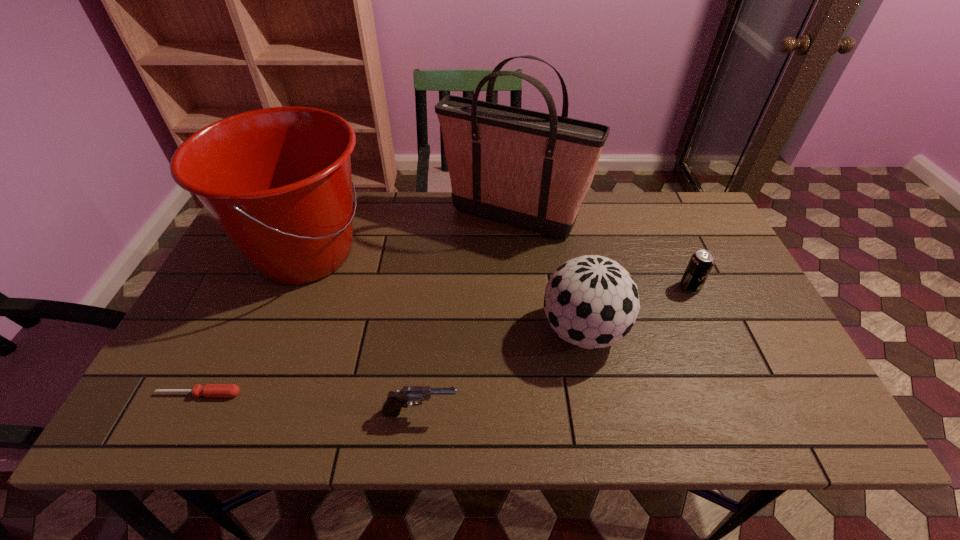
The width and height of the screenshot is (960, 540). I want to click on vacant area that lies between the shopping bag and the soda can, so click(x=601, y=253).

At what (x,y) coordinates should I click in order to perform the action: click on free spot between the shopping bag and the pistol. Please return your answer as a coordinate pair (x, y). Image resolution: width=960 pixels, height=540 pixels. Looking at the image, I should click on (467, 315).

Image resolution: width=960 pixels, height=540 pixels. I want to click on free space between the shopping bag and the fifth farthest object, so click(356, 306).

You are a GUI agent. You are given a task and a screenshot of the screen. Output one action in this format:
    pyautogui.click(x=<x>, y=<y>)
    Task: Click on the empty location between the pistol and the second tallest object
    
    Given the screenshot: What is the action you would take?
    pyautogui.click(x=364, y=333)

This screenshot has height=540, width=960. What are the coordinates of `free area in between the soccer ball and the shopping bag` in the screenshot? It's located at [x=548, y=274].

The height and width of the screenshot is (540, 960). What are the coordinates of `vacant area that lies between the bucket and the third tallest object` in the screenshot? It's located at [x=444, y=292].

Locate an element on the screen. vacant region between the nearest object and the soda can is located at coordinates [x=555, y=349].

Locate an element on the screen. The width and height of the screenshot is (960, 540). empty space that is in between the tallest object and the screwdriver is located at coordinates (356, 306).

Choose which object is the third nearest neighbor to the soda can. Please provide its 2D coordinates. Your answer should be formatted as a tuple, i.e. [(x, y)], where the tuple contains the x and y coordinates of a point satisfying the conditions above.

[(395, 401)]

Identify which object is located as the fourth nearest to the soda can. Please provide its 2D coordinates. Your answer should be formatted as a tuple, i.e. [(x, y)], where the tuple contains the x and y coordinates of a point satisfying the conditions above.

[(278, 182)]